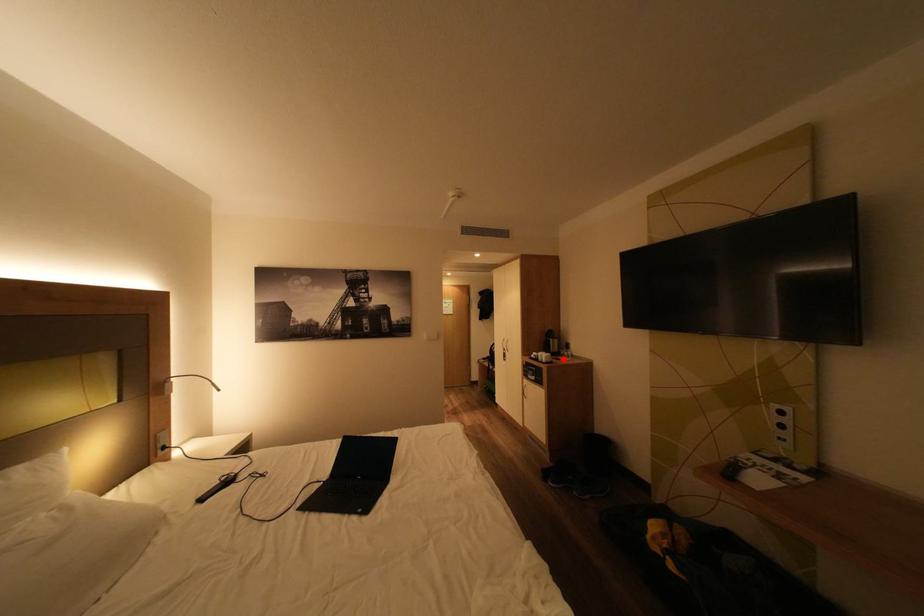
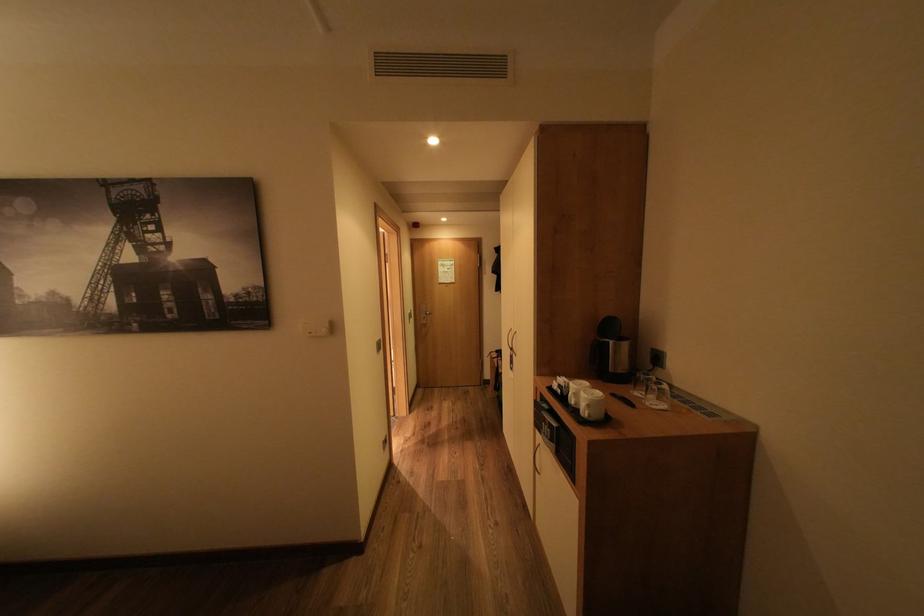
In the second image, find the point that corresponds to the highlighted location in the first image.

(624, 395)